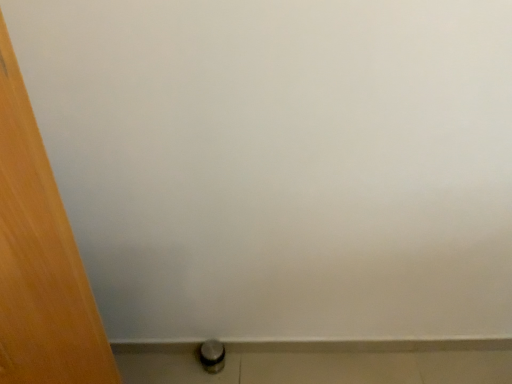
What do you see at coordinates (322, 362) in the screenshot?
I see `satin silver bath at lower center` at bounding box center [322, 362].

Measure the distance between satin silver bath at lower center and camera.

Answer: 3.88 feet.

Where is `satin silver bath at lower center`? Image resolution: width=512 pixels, height=384 pixels. satin silver bath at lower center is located at coordinates (322, 362).

Find the location of a particular element. satin silver bath at lower center is located at coordinates (322, 362).